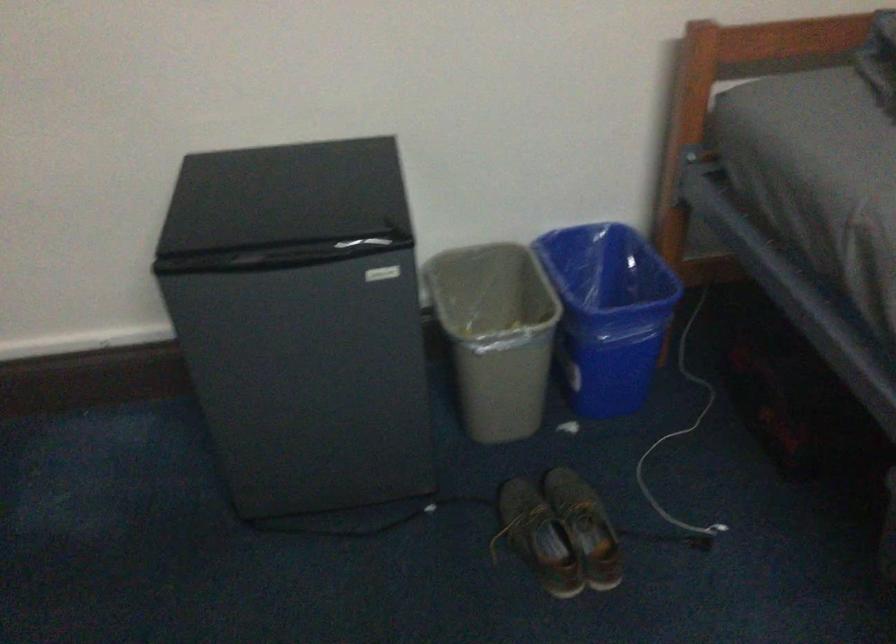
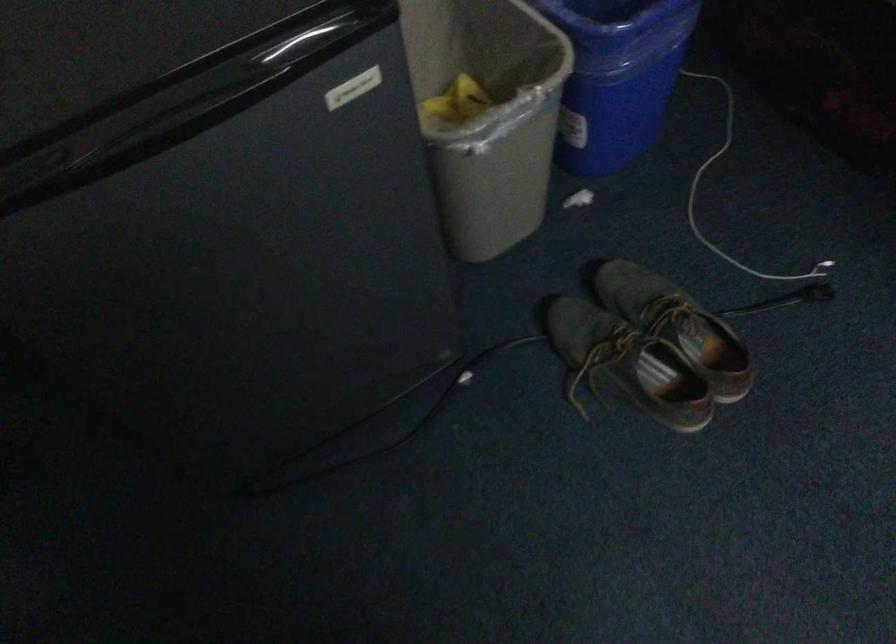
Find the pixel in the second image that matches (365,243) in the first image.

(309, 40)